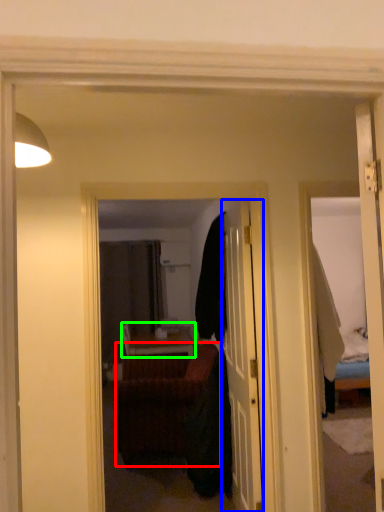
Question: Considering the real-world distances, which object is closest to studio couch (highlighted by a red box)? door (highlighted by a blue box) or table (highlighted by a green box).

Choices:
 (A) door
 (B) table

Answer: (A)